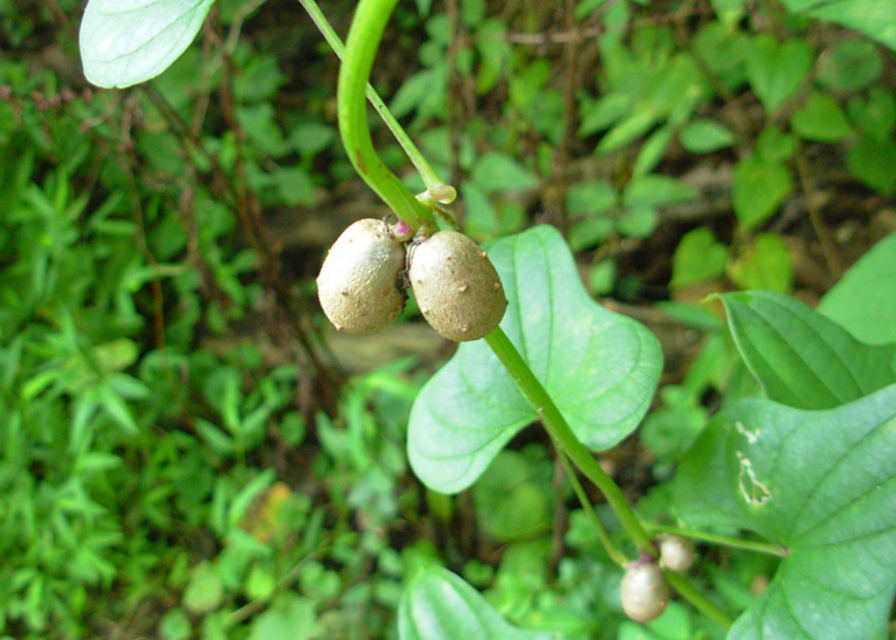
Does smooth beige pod at center appear on the right side of smooth beige fruit at center?

Incorrect, smooth beige pod at center is not on the right side of smooth beige fruit at center.

Between point (364, 259) and point (636, 598), which one is positioned in front?

Point (364, 259)

Does point (338, 243) lie behind point (635, 577)?

No.

Locate an element on the screen. smooth beige pod at center is located at coordinates (363, 276).

Which of these two, smooth brown seed at center or smooth beige fruit at center, stands shorter?

Standing shorter between the two is smooth beige fruit at center.

Which is in front, point (435, 292) or point (649, 588)?

Positioned in front is point (435, 292).

The width and height of the screenshot is (896, 640). What are the coordinates of `smooth brown seed at center` in the screenshot? It's located at (454, 285).

Based on the photo, does smooth beige pod at center lie in front of smooth brown seed at center?

No, smooth beige pod at center is further to the viewer.

The height and width of the screenshot is (640, 896). I want to click on smooth beige pod at center, so click(x=363, y=276).

Image resolution: width=896 pixels, height=640 pixels. I want to click on smooth beige pod at center, so click(x=363, y=276).